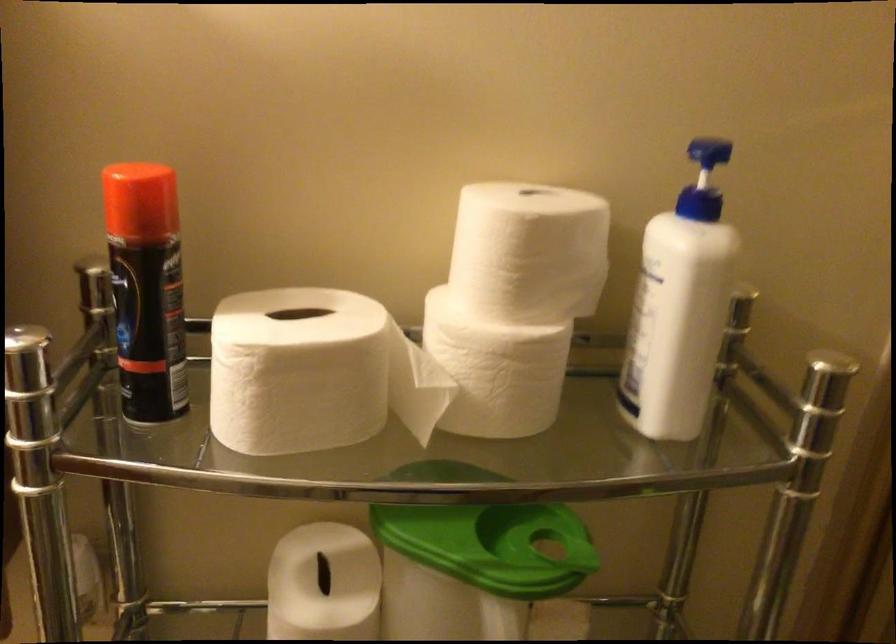
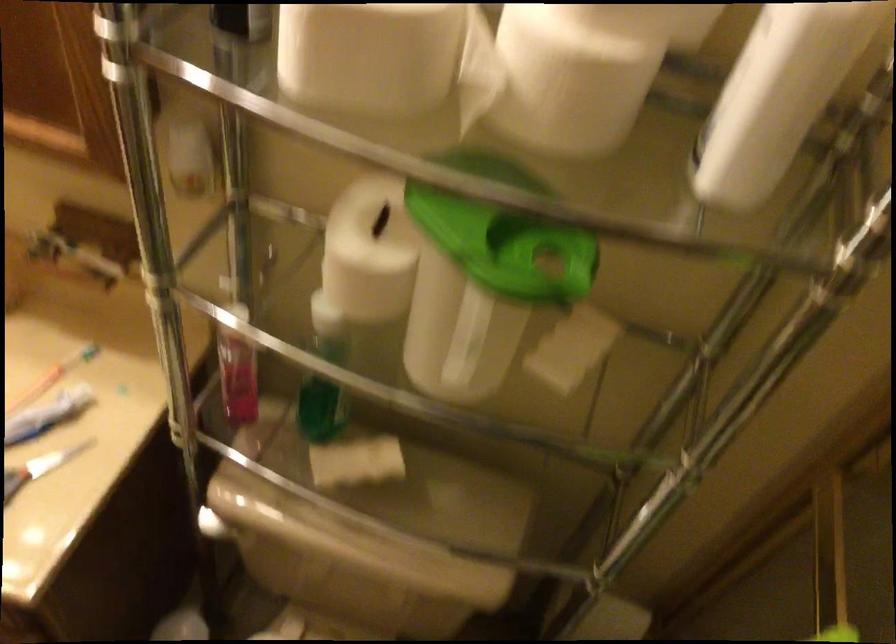
Where in the second image is the point corresponding to (x=321, y=393) from the first image?

(368, 55)